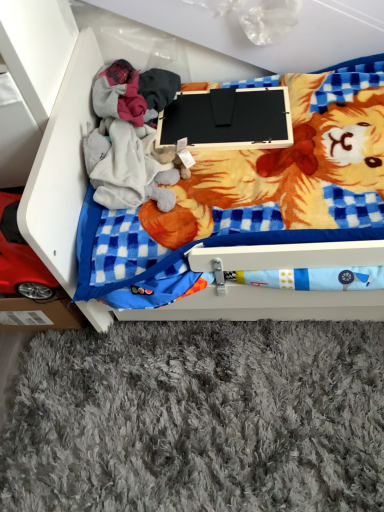
Question: Considering the relative sizes of wooden drawer at center and black matte laptop at center in the image provided, is wooden drawer at center shorter than black matte laptop at center?

Choices:
 (A) yes
 (B) no

Answer: (B)

Question: Is wooden drawer at center not near black matte laptop at center?

Choices:
 (A) yes
 (B) no

Answer: (B)

Question: From a real-world perspective, is wooden drawer at center under black matte laptop at center?

Choices:
 (A) yes
 (B) no

Answer: (A)

Question: Can we say wooden drawer at center lies outside black matte laptop at center?

Choices:
 (A) yes
 (B) no

Answer: (A)

Question: From the image's perspective, is wooden drawer at center over black matte laptop at center?

Choices:
 (A) no
 (B) yes

Answer: (A)

Question: Is wooden drawer at center touching black matte laptop at center?

Choices:
 (A) yes
 (B) no

Answer: (B)

Question: From the image's perspective, does wooden drawer at center appear lower than red plastic toy car at lower left?

Choices:
 (A) no
 (B) yes

Answer: (A)

Question: Is wooden drawer at center facing away from red plastic toy car at lower left?

Choices:
 (A) no
 (B) yes

Answer: (A)

Question: Considering the relative sizes of wooden drawer at center and red plastic toy car at lower left in the image provided, is wooden drawer at center taller than red plastic toy car at lower left?

Choices:
 (A) no
 (B) yes

Answer: (B)

Question: Is wooden drawer at center not close to red plastic toy car at lower left?

Choices:
 (A) yes
 (B) no

Answer: (B)

Question: Would you say red plastic toy car at lower left is part of wooden drawer at center's contents?

Choices:
 (A) yes
 (B) no

Answer: (B)

Question: Considering the relative positions of wooden drawer at center and red plastic toy car at lower left in the image provided, is wooden drawer at center to the right of red plastic toy car at lower left from the viewer's perspective?

Choices:
 (A) yes
 (B) no

Answer: (A)

Question: Can you confirm if black matte laptop at center is bigger than red plastic toy car at lower left?

Choices:
 (A) yes
 (B) no

Answer: (B)